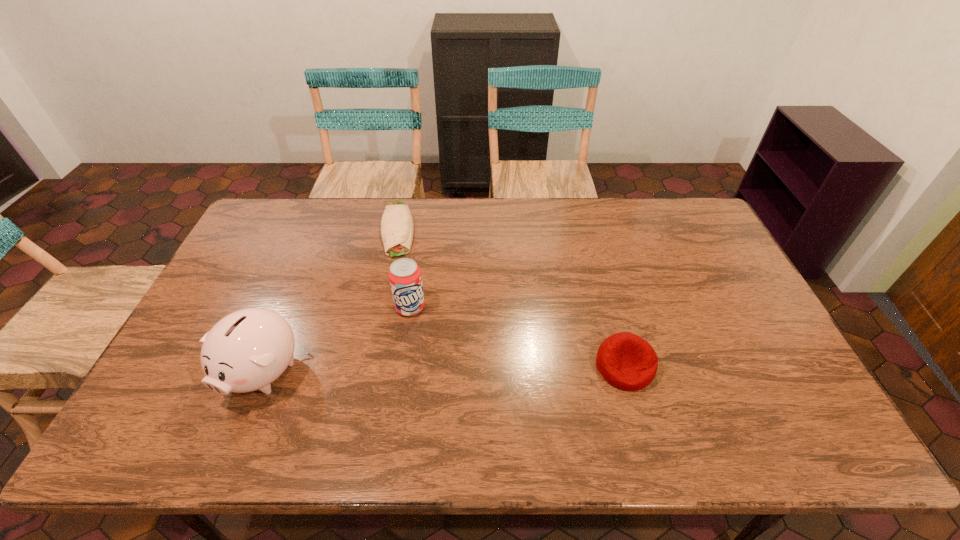
You are a GUI agent. You are given a task and a screenshot of the screen. Output one action in this format:
    pyautogui.click(x=<x>, y=<y>)
    Task: Click on the vacant space on the desktop that is between the leftmost object and the beanbag and is positioned at the bitten end of the farthest object
    
    Given the screenshot: What is the action you would take?
    pyautogui.click(x=400, y=369)

What are the coordinates of `vacant space on the desktop that is between the leftmost object and the rightmost object and is positioned on the surface of the third nearest object` in the screenshot? It's located at (405, 369).